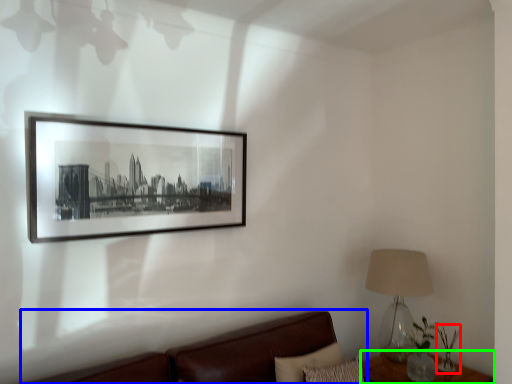
Question: Based on their relative distances, which object is farther from plant (highlighted by a red box)? Choose from studio couch (highlighted by a blue box) and table (highlighted by a green box).

Choices:
 (A) studio couch
 (B) table

Answer: (A)